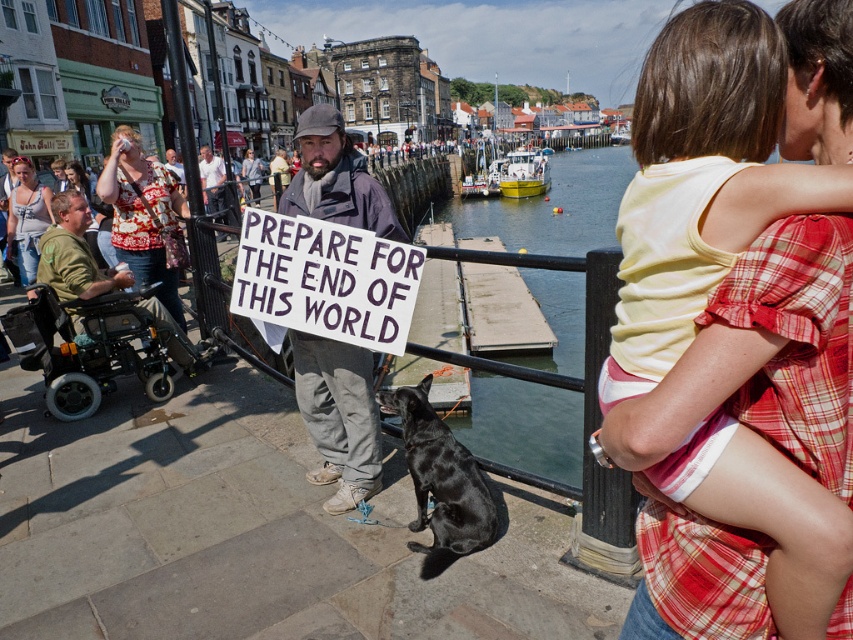
Looking at this image, you are standing at the point labeled point (297, 200) and want to walk to the point labeled point (171, 304). Which direction should you move in relation to the scene?

You should move backward because point (297, 200) is in front of point (171, 304), so moving backward will take you toward the latter point.

You are a photographer standing at the waterfront promenade. You see the black smooth dog at lower center and the dark gray jacket at center. Which object is more to the right?

The black smooth dog at lower center is more to the right because it is positioned on the right side of the dark gray jacket at center.

You are a pedestrian walking on the waterfront promenade and see the white paper sign at center and the dark gray jacket at center. Which object is located lower in the image?

The white paper sign at center is positioned under dark gray jacket at center, so the white paper sign at center is lower in the image.